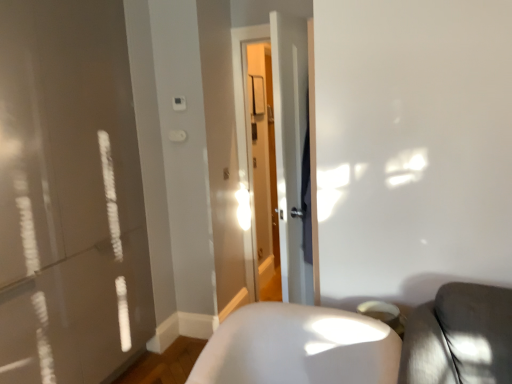
Question: Relative to transparent glass door at center, is white glossy chair at lower right in front or behind?

Choices:
 (A) behind
 (B) front

Answer: (B)

Question: Is white glossy chair at lower right taller or shorter than transparent glass door at center?

Choices:
 (A) short
 (B) tall

Answer: (A)

Question: From a real-world perspective, is white glossy chair at lower right above or below transparent glass door at center?

Choices:
 (A) below
 (B) above

Answer: (A)

Question: From the image's perspective, is transparent glass door at center located above or below white glossy chair at lower right?

Choices:
 (A) below
 (B) above

Answer: (B)

Question: Based on their positions, is transparent glass door at center located to the left or right of white glossy chair at lower right?

Choices:
 (A) left
 (B) right

Answer: (B)

Question: Is transparent glass door at center bigger or smaller than white glossy chair at lower right?

Choices:
 (A) small
 (B) big

Answer: (A)

Question: In terms of height, does transparent glass door at center look taller or shorter compared to white glossy chair at lower right?

Choices:
 (A) short
 (B) tall

Answer: (B)